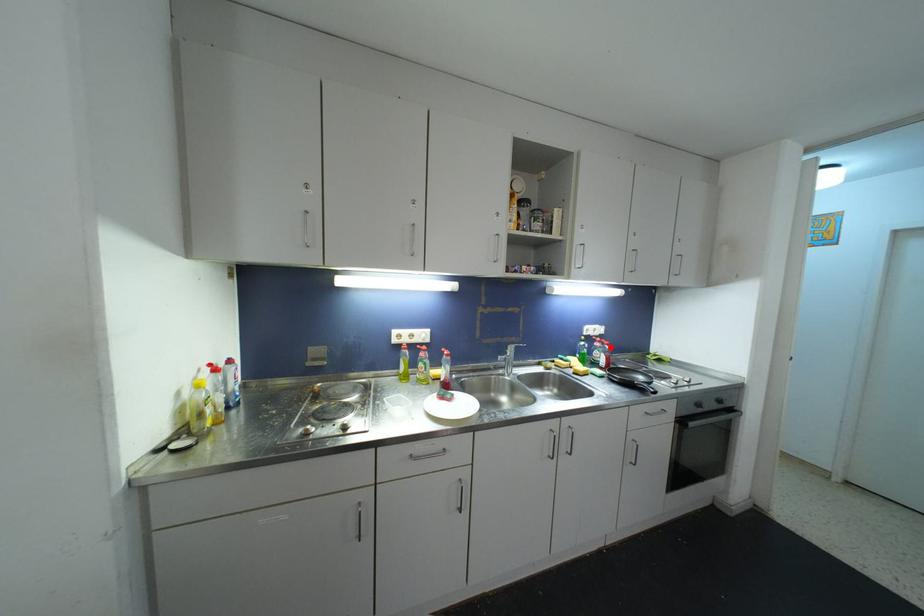
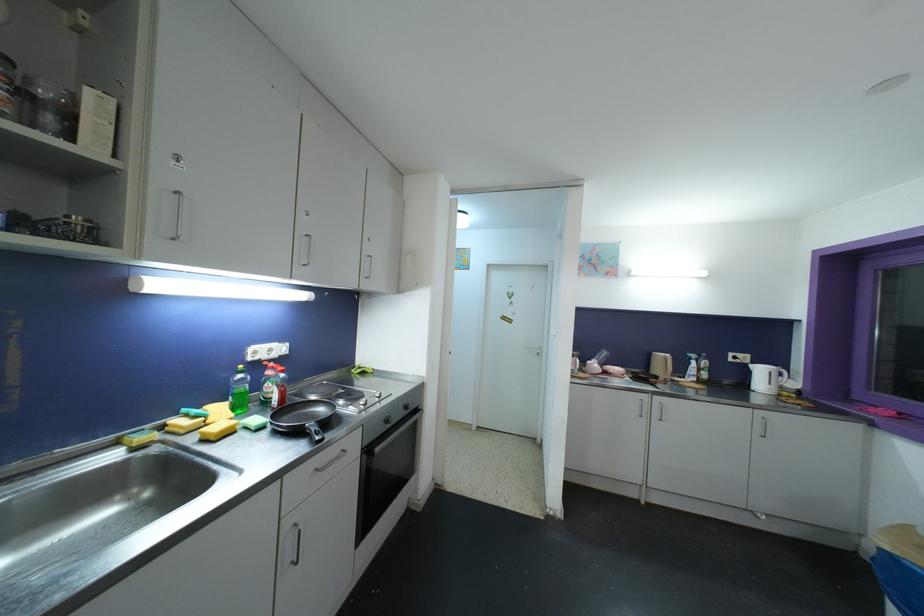
Where in the second image is the point corresponding to the highlighted location from the first image?

(286, 374)